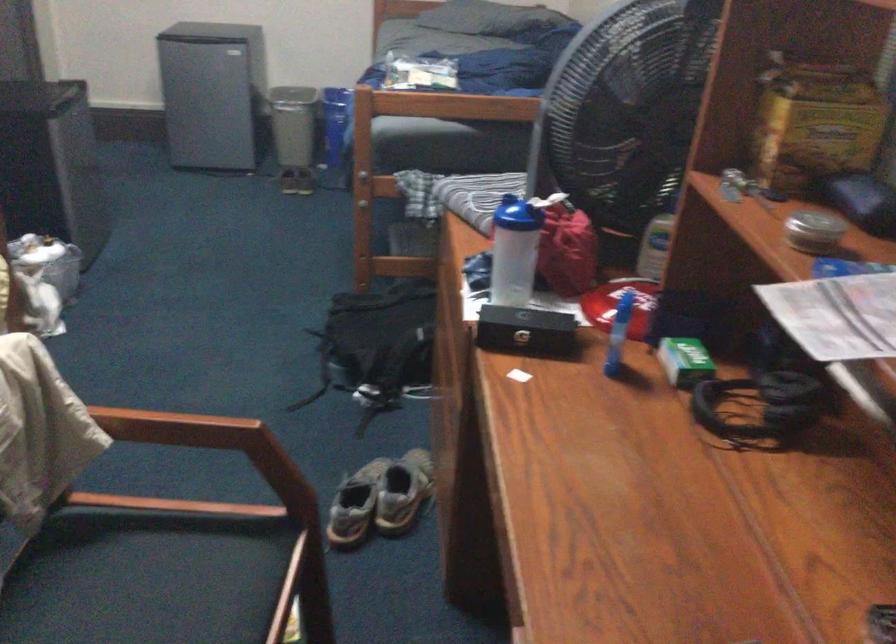
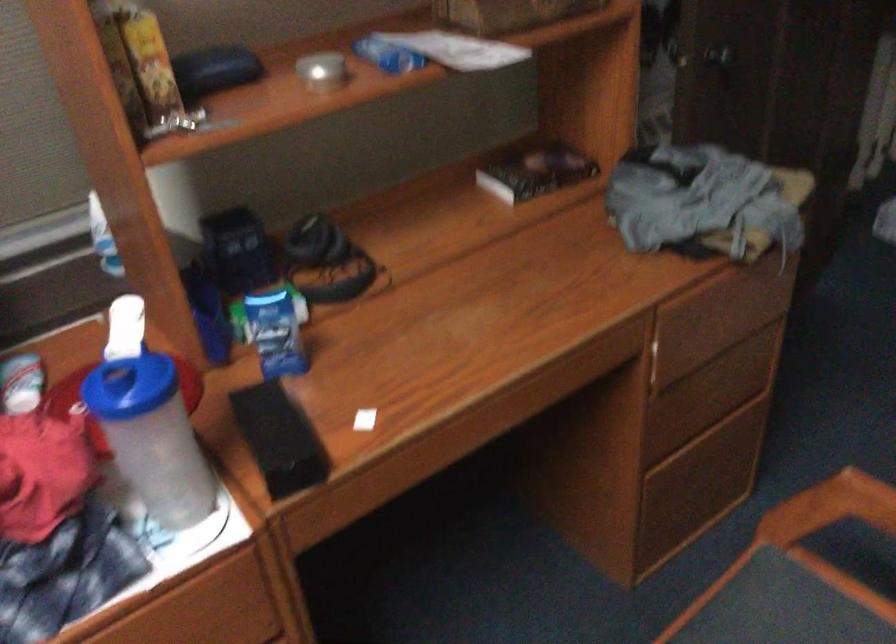
Find the pixel in the second image that matches [774,137] in the first image.

(149, 61)